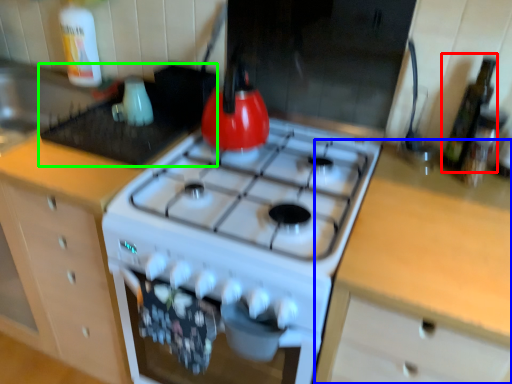
Question: Which object is positioned closest to bottle (highlighted by a red box)? Select from counter (highlighted by a blue box) and appliance (highlighted by a green box).

Choices:
 (A) counter
 (B) appliance

Answer: (A)